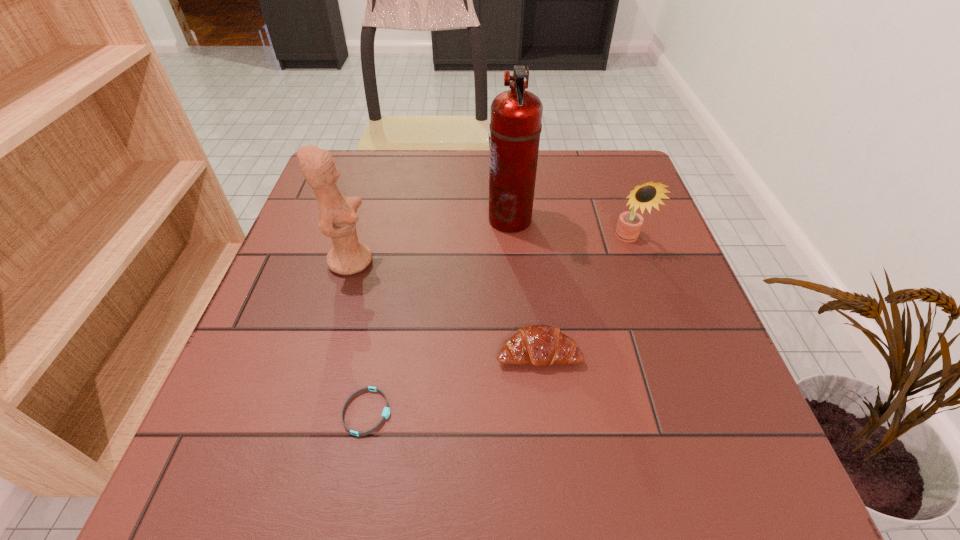
Image resolution: width=960 pixels, height=540 pixels. Find the location of `free region at the right edge of the desktop`. free region at the right edge of the desktop is located at coordinates (644, 368).

In the image, there is a desktop. Identify the location of free space at the far left corner. The height and width of the screenshot is (540, 960). (353, 150).

Locate an element on the screen. free space at the far right corner of the desktop is located at coordinates (579, 159).

The image size is (960, 540). What are the coordinates of `vacant space that's between the fourth shortest object and the fire extinguisher` in the screenshot? It's located at (430, 240).

You are a GUI agent. You are given a task and a screenshot of the screen. Output one action in this format:
    pyautogui.click(x=<x>, y=<y>)
    Task: Click on the empty space between the nearest object and the rightmost object
    
    Given the screenshot: What is the action you would take?
    coord(497,325)

I want to click on empty space between the rightmost object and the figurine, so click(x=490, y=249).

At what (x,y) coordinates should I click in order to perform the action: click on free area in between the fire extinguisher and the rightmost object. Please return your answer as a coordinate pair (x, y). Image resolution: width=960 pixels, height=540 pixels. Looking at the image, I should click on (569, 229).

Where is `vacant region between the second shortest object and the tallest object`? vacant region between the second shortest object and the tallest object is located at coordinates (524, 286).

Identify the location of empty space between the fire extinguisher and the fourth tallest object. The height and width of the screenshot is (540, 960). (524, 286).

Where is `free space that is in between the fourth tallest object and the rightmost object`? Image resolution: width=960 pixels, height=540 pixels. free space that is in between the fourth tallest object and the rightmost object is located at coordinates (584, 295).